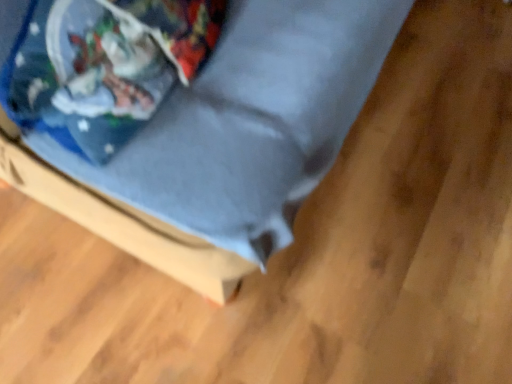
Question: From the image's perspective, is blue fabric bag at upper left over matte blue cushion at center?

Choices:
 (A) no
 (B) yes

Answer: (A)

Question: Does blue fabric bag at upper left come behind matte blue cushion at center?

Choices:
 (A) yes
 (B) no

Answer: (A)

Question: Is blue fabric bag at upper left to the right of matte blue cushion at center from the viewer's perspective?

Choices:
 (A) yes
 (B) no

Answer: (B)

Question: Does blue fabric bag at upper left have a lesser height compared to matte blue cushion at center?

Choices:
 (A) no
 (B) yes

Answer: (B)

Question: Is blue fabric bag at upper left looking in the opposite direction of matte blue cushion at center?

Choices:
 (A) no
 (B) yes

Answer: (B)

Question: Can you confirm if blue fabric bag at upper left is taller than matte blue cushion at center?

Choices:
 (A) no
 (B) yes

Answer: (A)

Question: Does matte blue cushion at center have a lesser width compared to blue fabric bag at upper left?

Choices:
 (A) no
 (B) yes

Answer: (A)

Question: From the image's perspective, does matte blue cushion at center appear lower than blue fabric bag at upper left?

Choices:
 (A) yes
 (B) no

Answer: (B)

Question: Is matte blue cushion at center at the right side of blue fabric bag at upper left?

Choices:
 (A) no
 (B) yes

Answer: (B)

Question: Could blue fabric bag at upper left be considered to be inside matte blue cushion at center?

Choices:
 (A) yes
 (B) no

Answer: (A)

Question: Does matte blue cushion at center have a greater width compared to blue fabric bag at upper left?

Choices:
 (A) yes
 (B) no

Answer: (A)

Question: From a real-world perspective, is matte blue cushion at center below blue fabric bag at upper left?

Choices:
 (A) yes
 (B) no

Answer: (A)

Question: From the image's perspective, is blue fabric bag at upper left above or below matte blue cushion at center?

Choices:
 (A) below
 (B) above

Answer: (A)